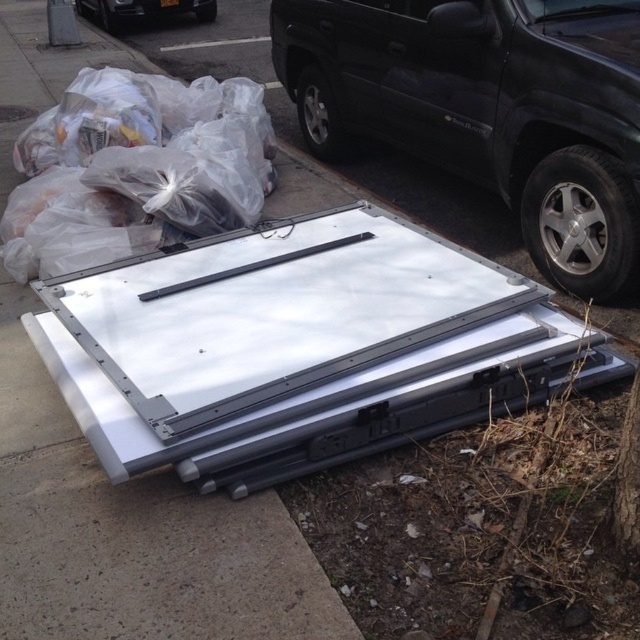
You are a delivery person trying to park your black plastic car at upper center near the curb. There is a tree with brown rough bark at lower right in the way. Can you park your car there without hitting the tree?

The brown rough bark at lower right is not as tall as the black plastic car at upper center, so the car can park there without hitting the tree since the tree is shorter than the car.

You are standing on the sidewalk and see the black plastic suv at upper right. Where exactly is it located in terms of coordinates?

The black plastic suv at upper right is located at coordinates point [488,109].

You are a delivery person trying to park your 2.5 meters wide delivery truck in the space between the black plastic suv at upper right and the brown rough bark at lower right. Can you fit your truck there?

The black plastic suv at upper right might be wider than brown rough bark at lower right, so it is uncertain if there is enough space for the delivery truck. Check the actual width before attempting to park.